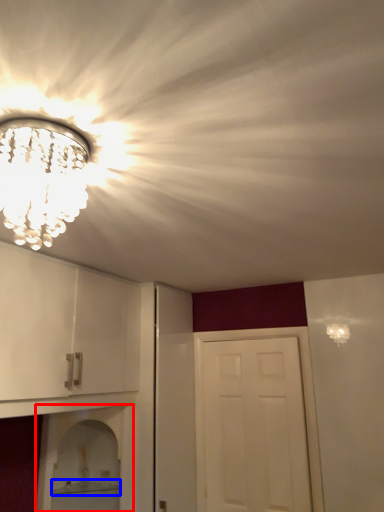
Question: Which of the following is the closest to the observer, shelf (highlighted by a red box) or shelf (highlighted by a blue box)?

Choices:
 (A) shelf
 (B) shelf

Answer: (A)